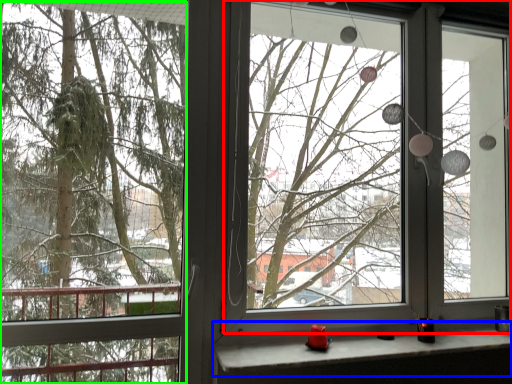
Question: Estimate the real-world distances between objects in this image. Which object is farther from window screen (highlighted by a red box), window sill (highlighted by a blue box) or tree (highlighted by a green box)?

Choices:
 (A) window sill
 (B) tree

Answer: (A)